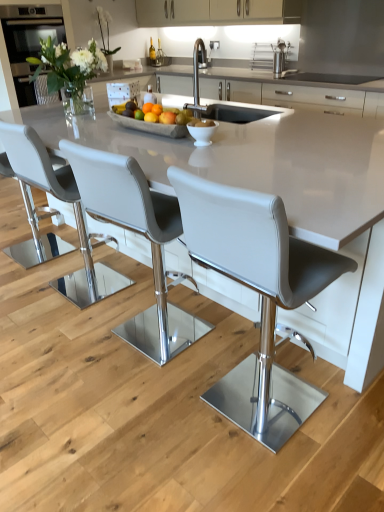
Question: Can you confirm if matte black oven at upper left is taller than orange matte at center, the first orange in the top-to-bottom sequence?

Choices:
 (A) no
 (B) yes

Answer: (B)

Question: From the image's perspective, is matte black oven at upper left below orange matte at center, arranged as the 1th orange when viewed from the back?

Choices:
 (A) yes
 (B) no

Answer: (B)

Question: Is matte black oven at upper left wider than orange matte at center, positioned as the second orange in bottom-to-top order?

Choices:
 (A) yes
 (B) no

Answer: (A)

Question: Is the position of matte black oven at upper left less distant than that of orange matte at center, positioned as the second orange in bottom-to-top order?

Choices:
 (A) no
 (B) yes

Answer: (A)

Question: Can you confirm if matte black oven at upper left is shorter than orange matte at center, placed as the 2th orange when sorted from front to back?

Choices:
 (A) yes
 (B) no

Answer: (B)

Question: Based on their sizes in the image, would you say stainless steel rack at upper center is bigger or smaller than yellow matte orange at center, the 1th orange positioned from the bottom?

Choices:
 (A) big
 (B) small

Answer: (A)

Question: Is point (281, 45) closer or farther from the camera than point (152, 118)?

Choices:
 (A) closer
 (B) farther

Answer: (B)

Question: From a real-world perspective, is stainless steel rack at upper center positioned above or below yellow matte orange at center, the 1th orange positioned from the bottom?

Choices:
 (A) above
 (B) below

Answer: (A)

Question: Is stainless steel rack at upper center taller or shorter than yellow matte orange at center, the first orange when ordered from front to back?

Choices:
 (A) tall
 (B) short

Answer: (A)

Question: From the image's perspective, is white leather stool at center, marked as the third chair in a left-to-right arrangement, above or below matte gray chair at center, which is the fourth chair in left-to-right order?

Choices:
 (A) below
 (B) above

Answer: (B)

Question: Visually, is white leather stool at center, marked as the third chair in a left-to-right arrangement, positioned to the left or to the right of matte gray chair at center, which is the 1th chair in right-to-left order?

Choices:
 (A) left
 (B) right

Answer: (A)

Question: Relative to matte gray chair at center, which is the 1th chair in right-to-left order, is white leather stool at center, marked as the third chair in a left-to-right arrangement, in front or behind?

Choices:
 (A) front
 (B) behind

Answer: (B)

Question: Looking at their shapes, would you say white leather stool at center, the 2th chair when ordered from right to left, is wider or thinner than matte gray chair at center, which is the 1th chair in right-to-left order?

Choices:
 (A) wide
 (B) thin

Answer: (A)

Question: From a real-world perspective, is matte black oven at upper left positioned above or below matte white cabinets at upper center?

Choices:
 (A) below
 (B) above

Answer: (A)

Question: Is matte black oven at upper left taller or shorter than matte white cabinets at upper center?

Choices:
 (A) tall
 (B) short

Answer: (A)